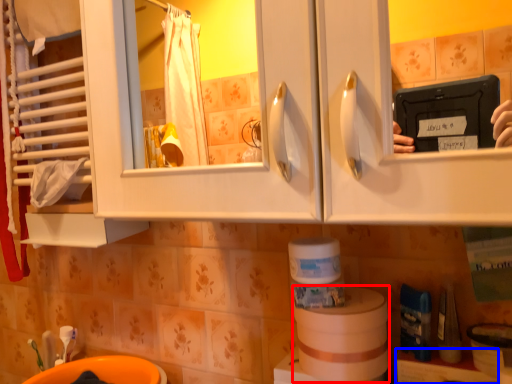
Question: Which of the following is the closest to the observer, toilet paper (highlighted by a red box) or shelf (highlighted by a blue box)?

Choices:
 (A) toilet paper
 (B) shelf

Answer: (B)